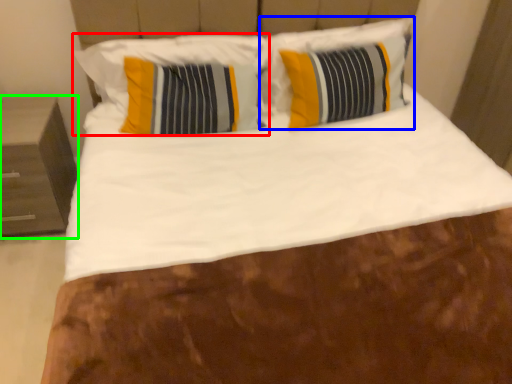
Question: Considering the real-world distances, which object is closest to pillow (highlighted by a red box)? pillow (highlighted by a blue box) or nightstand (highlighted by a green box).

Choices:
 (A) pillow
 (B) nightstand

Answer: (A)